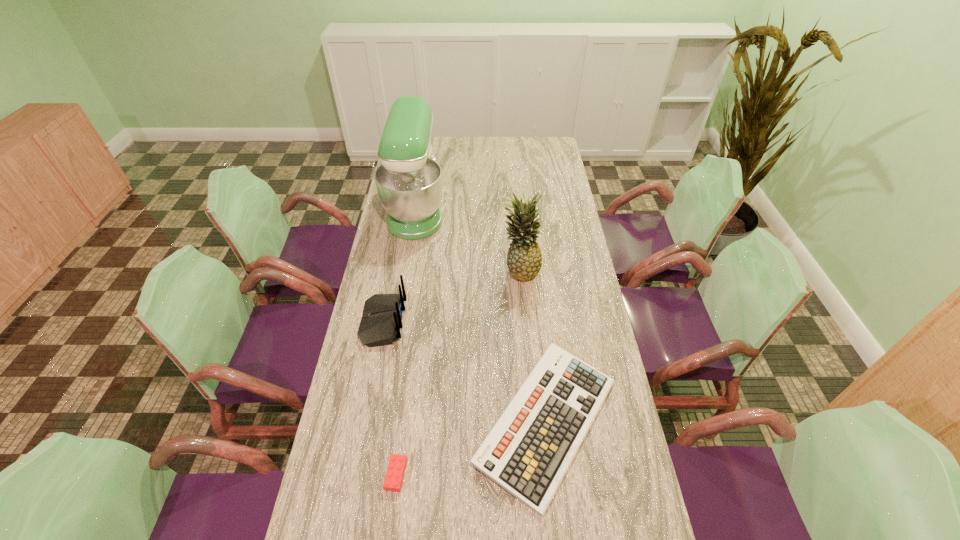
Locate an element on the screen. empty space that is in between the pineapple and the third tallest object is located at coordinates (451, 296).

The width and height of the screenshot is (960, 540). I want to click on empty space that is in between the third farthest object and the tallest object, so click(400, 266).

The width and height of the screenshot is (960, 540). I want to click on free point between the Lego and the second shortest object, so click(x=471, y=448).

The image size is (960, 540). I want to click on free spot between the third farthest object and the shortest object, so click(x=390, y=399).

You are a GUI agent. You are given a task and a screenshot of the screen. Output one action in this format:
    pyautogui.click(x=<x>, y=<y>)
    Task: Click on the free space between the pineapple and the shortest object
    Image resolution: width=960 pixels, height=540 pixels.
    Given the screenshot: What is the action you would take?
    pyautogui.click(x=458, y=372)

In order to click on empty space that is in between the Lego and the computer keyboard in this screenshot , I will do `click(471, 448)`.

The width and height of the screenshot is (960, 540). Find the location of `free space that is in between the fourth shortest object and the third shortest object`. free space that is in between the fourth shortest object and the third shortest object is located at coordinates (451, 296).

Locate an element on the screen. The width and height of the screenshot is (960, 540). vacant area that lies between the computer keyboard and the farthest object is located at coordinates [x=482, y=316].

Find the location of `vacant point located between the shortest object and the router`. vacant point located between the shortest object and the router is located at coordinates (390, 399).

Identify the location of vacant area between the router and the second shortest object. Image resolution: width=960 pixels, height=540 pixels. (465, 372).